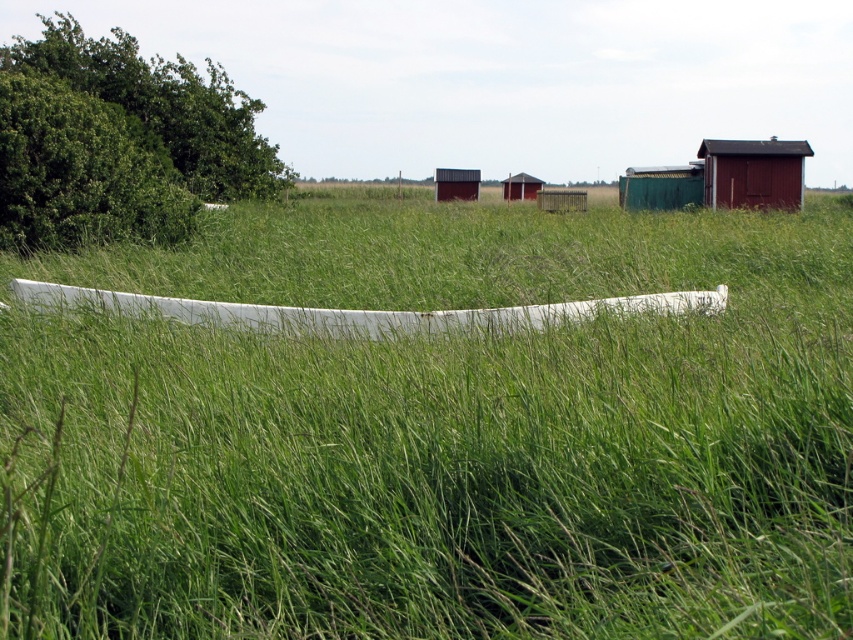
Where is `white plastic pipe at center`? The height and width of the screenshot is (640, 853). white plastic pipe at center is located at coordinates (438, 433).

Who is shorter, white plastic pipe at center or white plastic boat at center?

Standing shorter between the two is white plastic boat at center.

Image resolution: width=853 pixels, height=640 pixels. What are the coordinates of `white plastic pipe at center` in the screenshot? It's located at (438, 433).

Between rustic wooden hut at center and wooden hut at center, which one appears on the left side from the viewer's perspective?

rustic wooden hut at center is more to the left.

Who is more distant from viewer, [437,186] or [514,189]?

The point [437,186] is behind.

What do you see at coordinates (456, 182) in the screenshot? I see `rustic wooden hut at center` at bounding box center [456, 182].

This screenshot has height=640, width=853. Find the location of `rustic wooden hut at center`. rustic wooden hut at center is located at coordinates (456, 182).

Measure the distance between white plastic boat at center and matte red wooden hut at upper right.

34.10 meters

Does white plastic boat at center appear under matte red wooden hut at upper right?

Yes, white plastic boat at center is below matte red wooden hut at upper right.

Measure the distance between point (160,298) and camera.

Point (160,298) and camera are 10.23 meters apart from each other.

I want to click on white plastic boat at center, so click(361, 310).